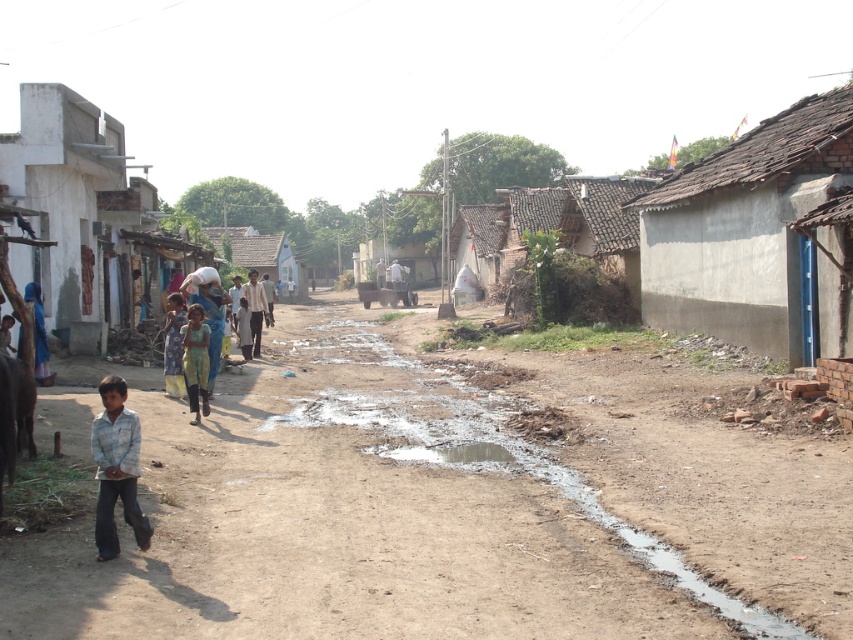
You are a traveler on the rural street and want to place your backpack on the ground near the blue fabric bag at center. What coordinate should you use to place your backpack?

You should place your backpack at the coordinate point of (201, 336) where the blue fabric bag at center is located.